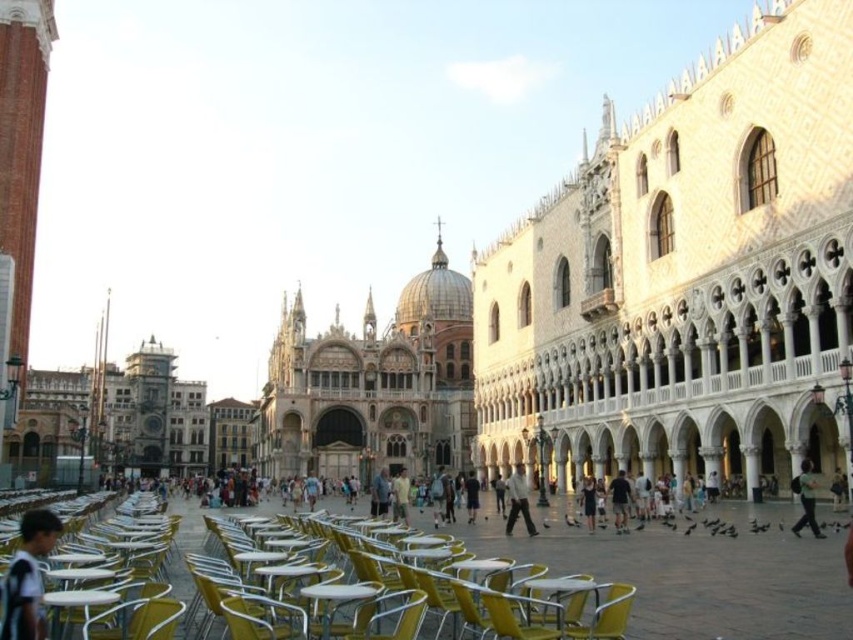
You are a photographer standing in the square and see a person wearing a light yellow shirt at center and dark blue jeans at center. Which part of their clothing is higher up on their body?

The light yellow shirt at center is much taller as dark blue jeans at center, so the light yellow shirt at center is higher up on their body.

You are standing in the square facing the Doge Palace. You see two points marked on the palace facade. The first point is at coordinate (399,488) and the second is at (469,522). Which point is closer to you?

Point (399,488) is closer to you because it is further to the viewer than point (469,522).

You are standing in the square and want to take a photo that includes both the golden mosaic dome at center and the metallic yellow table at lower left. Which object should you position closer to the front of your photo?

To include both the golden mosaic dome at center and the metallic yellow table at lower left in your photo, position the metallic yellow table at lower left closer to the front. Since the golden mosaic dome at center is further away, placing the table near the front will ensure both are in frame without the dome being too far back.